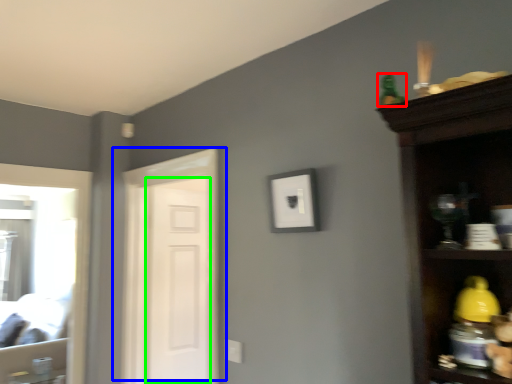
Question: Which object is the closest to the toy (highlighted by a red box)? Choose among these: door (highlighted by a blue box) or screen door (highlighted by a green box).

Choices:
 (A) door
 (B) screen door

Answer: (A)